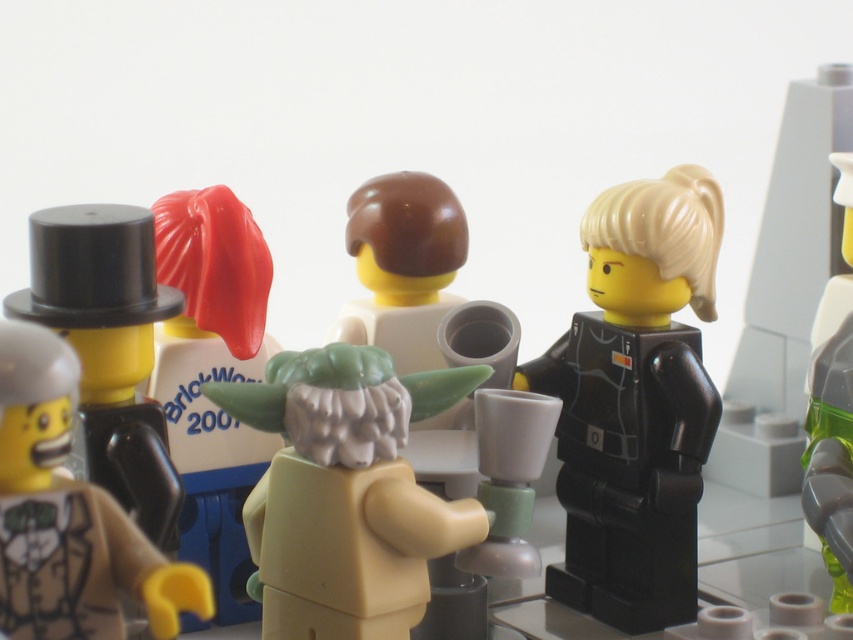
Question: Does smooth green figure at center have a smaller size compared to brown matte head at center?

Choices:
 (A) yes
 (B) no

Answer: (A)

Question: Is black plastic minifigure at center-right thinner than brown matte head at center?

Choices:
 (A) no
 (B) yes

Answer: (A)

Question: Which point is closer to the camera?

Choices:
 (A) (178, 324)
 (B) (352, 561)
 (C) (503, 337)
 (D) (73, 486)

Answer: (D)

Question: Does shiny red hair at upper left appear on the right side of brown matte head at center?

Choices:
 (A) yes
 (B) no

Answer: (B)

Question: Which point is farther to the camera?

Choices:
 (A) shiny red hair at upper left
 (B) green translucent plastic minifigure at right
 (C) black plastic minifigure at center-right
 (D) matte black top hat at left

Answer: (A)

Question: Which object is the farthest from the shiny red hair at upper left?

Choices:
 (A) matte black top hat at left
 (B) black plastic minifigure at center-right
 (C) green translucent plastic minifigure at right

Answer: (C)